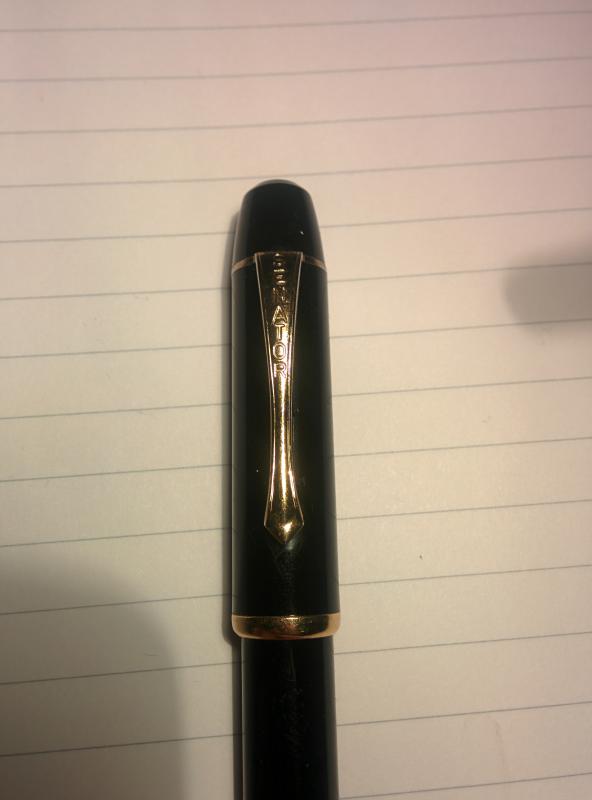
In order to click on biro in this screenshot , I will do `click(274, 686)`.